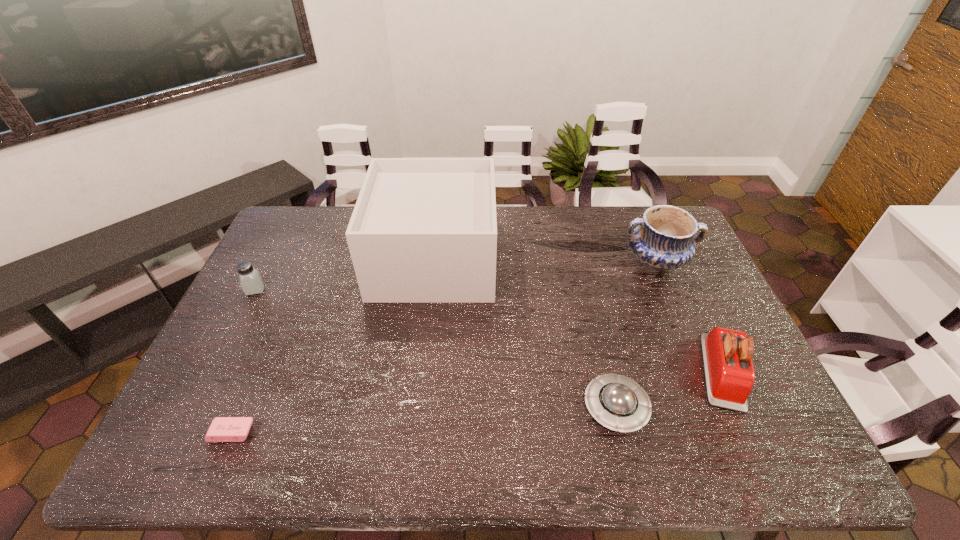
In the image, there is a desktop. At what (x,y) coordinates should I click in order to perform the action: click on vacant area at the far left corner. Please return your answer as a coordinate pair (x, y). Looking at the image, I should click on (301, 212).

Identify the location of vacant space at the near left corner of the desktop. (176, 448).

Identify the location of free space at the near right corner of the desktop. (784, 449).

The width and height of the screenshot is (960, 540). In order to click on free space between the fifth tallest object and the toaster in this screenshot , I will do `click(669, 389)`.

Where is `free spot between the toaster and the saucer`? This screenshot has width=960, height=540. free spot between the toaster and the saucer is located at coordinates (669, 389).

In order to click on free space between the fourth tallest object and the fourth object from right to left in this screenshot , I will do `click(345, 274)`.

The width and height of the screenshot is (960, 540). I want to click on vacant space that is in between the fourth object from left to right and the toaster, so click(669, 389).

Locate an element on the screen. This screenshot has width=960, height=540. free space between the toaster and the pottery is located at coordinates (689, 316).

You are a GUI agent. You are given a task and a screenshot of the screen. Output one action in this format:
    pyautogui.click(x=<x>, y=<y>)
    Task: Click on the free space that is in between the third object from right to left and the second tallest object
    The image size is (960, 540).
    Given the screenshot: What is the action you would take?
    pyautogui.click(x=636, y=334)

This screenshot has height=540, width=960. Identify the location of free space between the fourth object from left to right and the shortest object. (423, 420).